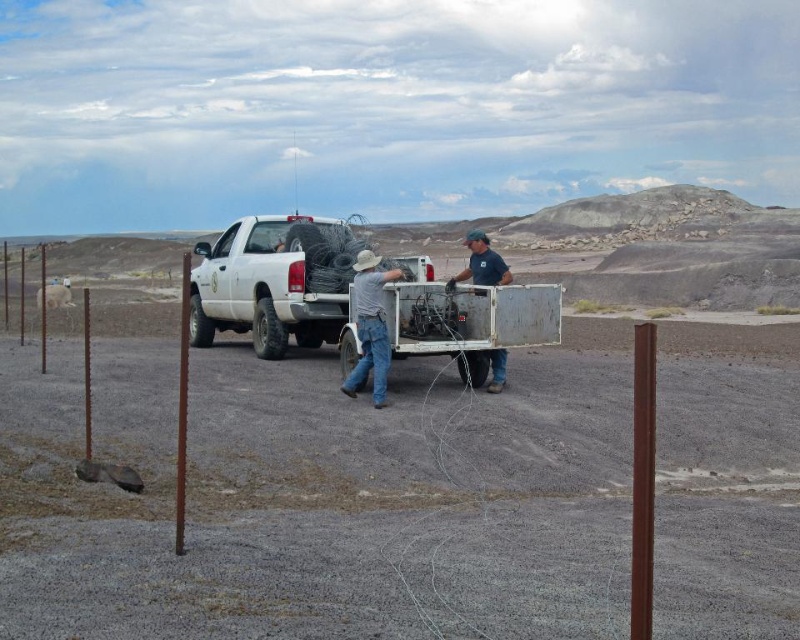
Is white matte truck at center positioned at the back of blue fabric shirt at center?

Yes, it is behind blue fabric shirt at center.

Does white matte truck at center have a lesser height compared to blue fabric shirt at center?

Indeed, white matte truck at center has a lesser height compared to blue fabric shirt at center.

Is point (337, 321) in front of point (492, 381)?

No, it is behind (492, 381).

Locate an element on the screen. This screenshot has width=800, height=640. white matte truck at center is located at coordinates (274, 282).

Between point (208, 257) and point (360, 314), which one is positioned behind?

The point (208, 257) is more distant.

Is white matte truck at center closer to camera compared to denim jeans at center?

No, white matte truck at center is behind denim jeans at center.

Which is in front, point (408, 268) or point (360, 284)?

Positioned in front is point (360, 284).

The image size is (800, 640). What are the coordinates of `white matte truck at center` in the screenshot? It's located at (274, 282).

Who is positioned more to the left, denim jeans at center or blue fabric shirt at center?

From the viewer's perspective, denim jeans at center appears more on the left side.

Describe the element at coordinates (370, 326) in the screenshot. Image resolution: width=800 pixels, height=640 pixels. I see `denim jeans at center` at that location.

You are a GUI agent. You are given a task and a screenshot of the screen. Output one action in this format:
    pyautogui.click(x=<x>, y=<y>)
    Task: Click on the denim jeans at center
    
    Given the screenshot: What is the action you would take?
    pyautogui.click(x=370, y=326)